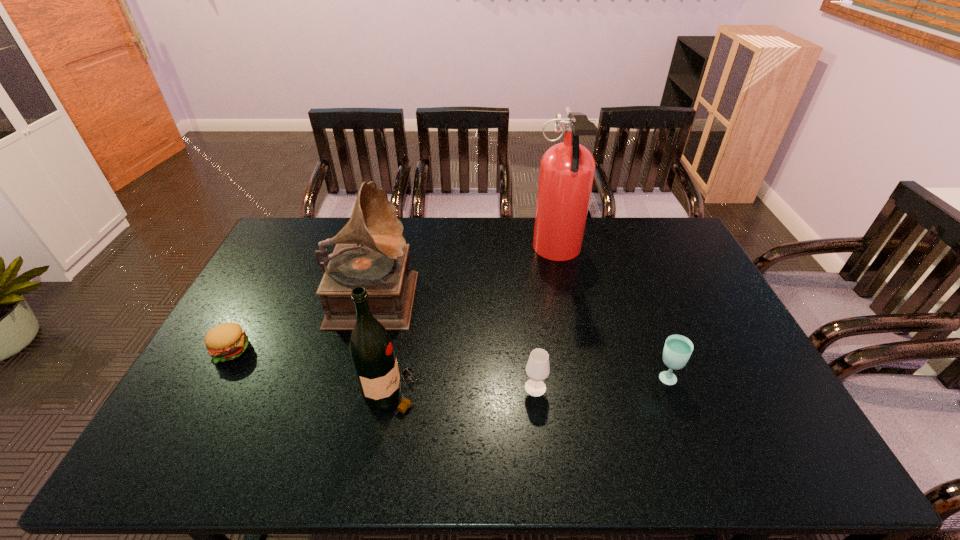
Locate which object ranks second in proximity to the record player. Please provide its 2D coordinates. Your answer should be formatted as a tuple, i.e. [(x, y)], where the tuple contains the x and y coordinates of a point satisfying the conditions above.

[(227, 341)]

Find the location of `free point that satisfies the following two spatial constraints: 1. from the horn of the record player; 2. on the left side of the left glass`. free point that satisfies the following two spatial constraints: 1. from the horn of the record player; 2. on the left side of the left glass is located at coordinates (348, 388).

Where is `free space in the image that satisfies the following two spatial constraints: 1. from the horn of the record player; 2. on the back side of the right glass`? Image resolution: width=960 pixels, height=540 pixels. free space in the image that satisfies the following two spatial constraints: 1. from the horn of the record player; 2. on the back side of the right glass is located at coordinates pos(350,379).

At what (x,y) coordinates should I click in order to perform the action: click on blank area in the image that satisfies the following two spatial constraints: 1. on the back side of the fourth object from left to right; 2. from the horn of the record player. Please return your answer as a coordinate pair (x, y). Looking at the image, I should click on (525, 293).

Where is `blank space that satisfies the following two spatial constraints: 1. on the back side of the left glass; 2. from the horn of the record player`? Image resolution: width=960 pixels, height=540 pixels. blank space that satisfies the following two spatial constraints: 1. on the back side of the left glass; 2. from the horn of the record player is located at coordinates point(525,293).